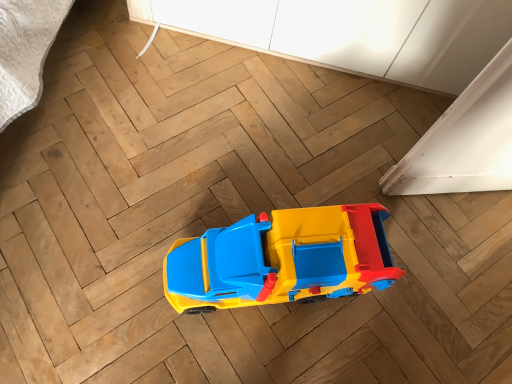
Locate an element on the screen. The width and height of the screenshot is (512, 384). free spot to the right of matte plastic toy car at center is located at coordinates (402, 304).